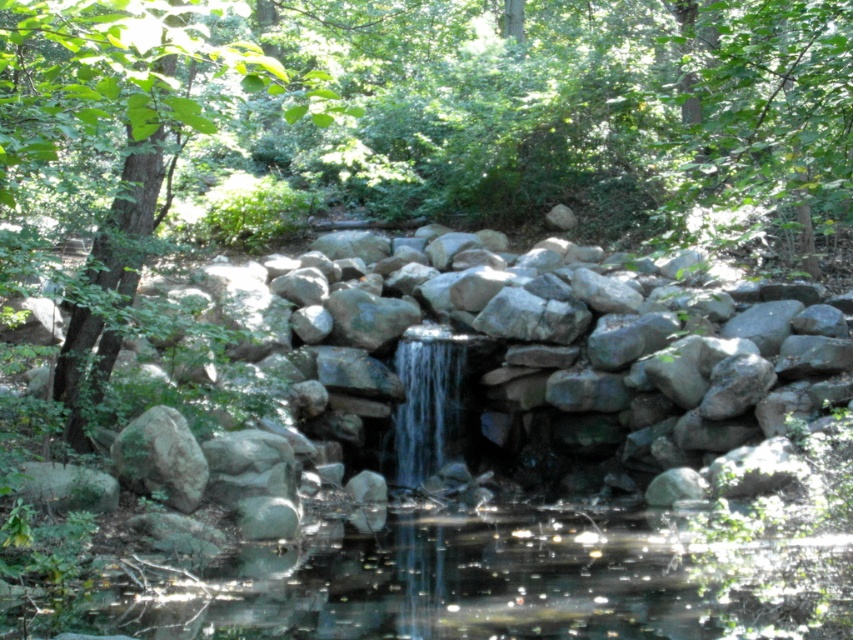
Question: Which point is farther from the camera taking this photo?

Choices:
 (A) (467, 548)
 (B) (822, 195)

Answer: (A)

Question: Does clear water at center appear over green leafy tree at upper center?

Choices:
 (A) yes
 (B) no

Answer: (B)

Question: Can you confirm if clear water at center is smaller than green leafy tree at upper center?

Choices:
 (A) yes
 (B) no

Answer: (A)

Question: Is clear water at center positioned at the back of green leafy tree at upper center?

Choices:
 (A) no
 (B) yes

Answer: (B)

Question: Which point is closer to the camera?

Choices:
 (A) (761, 33)
 (B) (572, 579)

Answer: (A)